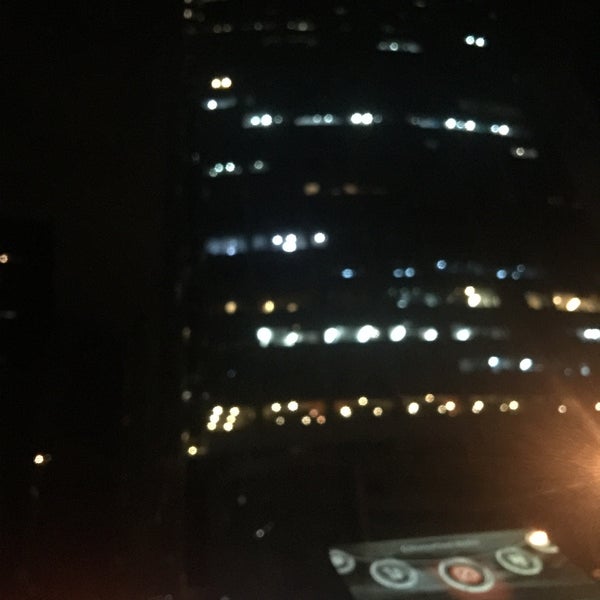
The height and width of the screenshot is (600, 600). I want to click on light, so 537,542.